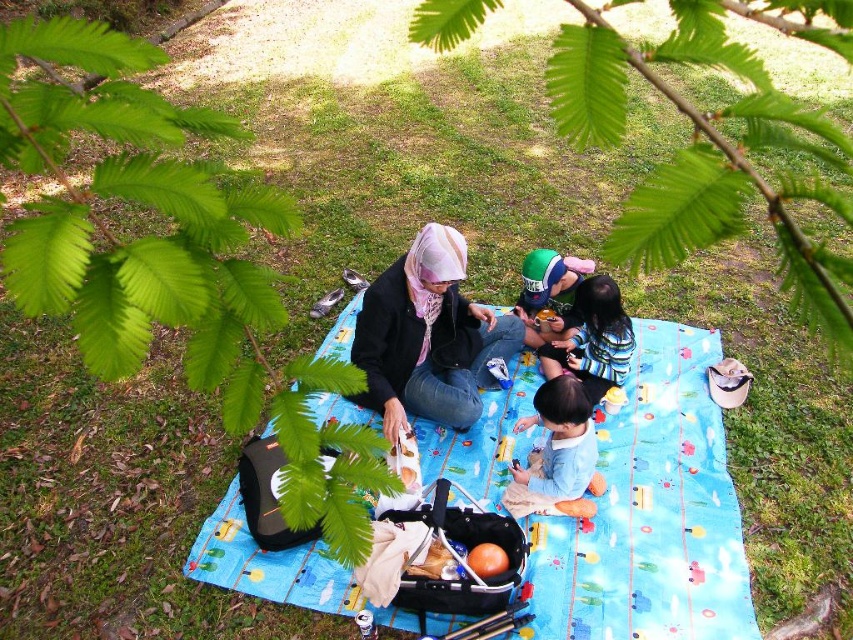
Is green leafy branch at upper left smaller than matte black jacket at center?

No.

Is green leafy branch at upper left positioned before matte black jacket at center?

That is True.

Find the location of a particular element. green leafy branch at upper left is located at coordinates (167, 259).

Can you confirm if blue fabric picnic blanket at center is positioned to the right of striped fabric shirt at center?

No, blue fabric picnic blanket at center is not to the right of striped fabric shirt at center.

Where is `blue fabric picnic blanket at center`? blue fabric picnic blanket at center is located at coordinates 651,515.

Who is more forward, (705, 605) or (415, 356)?

Positioned in front is point (705, 605).

Who is more distant from viewer, (335, 353) or (508, 317)?

Positioned behind is point (335, 353).

Who is more forward, (720,580) or (447,388)?

Point (720,580) is more forward.

Identify the location of blue fabric picnic blanket at center. The height and width of the screenshot is (640, 853). (651, 515).